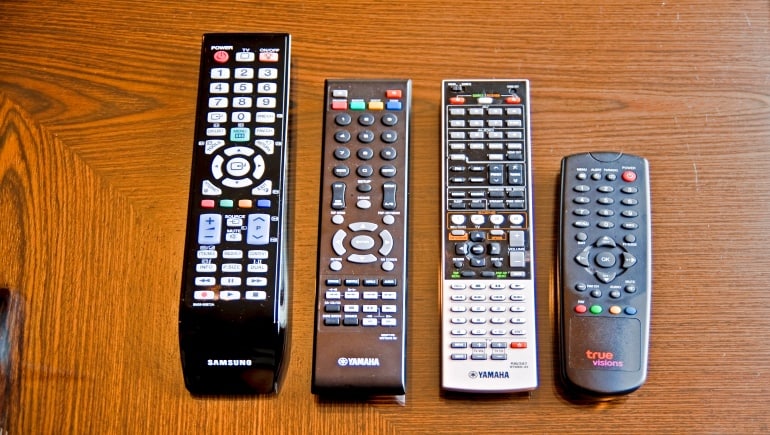
The width and height of the screenshot is (770, 435). In order to click on red "power" buttons in this screenshot , I will do `click(216, 54)`, `click(393, 92)`, `click(513, 99)`, `click(628, 176)`.